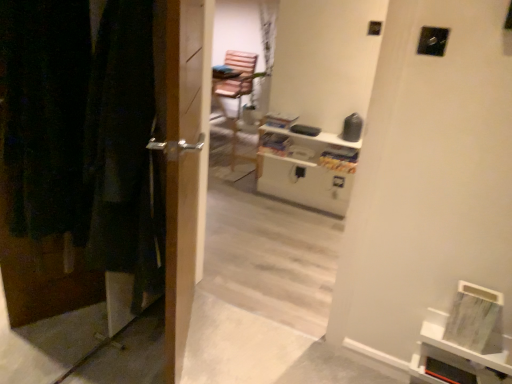
Question: Is point (193, 221) closer or farther from the camera than point (449, 342)?

Choices:
 (A) farther
 (B) closer

Answer: (B)

Question: Is metallic silver handle at left bigger or smaller than white matte bookshelf at lower right?

Choices:
 (A) small
 (B) big

Answer: (B)

Question: Which is farther from the white glossy entertainment center at upper center?

Choices:
 (A) wooden door at left
 (B) metallic silver handle at left
 (C) white matte bookshelf at lower right

Answer: (A)

Question: Which object is positioned farthest from the wooden door at left?

Choices:
 (A) metallic silver handle at left
 (B) white glossy entertainment center at upper center
 (C) white matte bookshelf at lower right

Answer: (B)